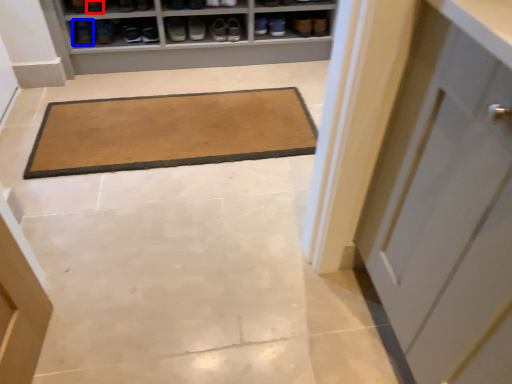
Question: Which object appears closest to the camera in this image, shoe (highlighted by a red box) or footwear (highlighted by a blue box)?

Choices:
 (A) shoe
 (B) footwear

Answer: (A)